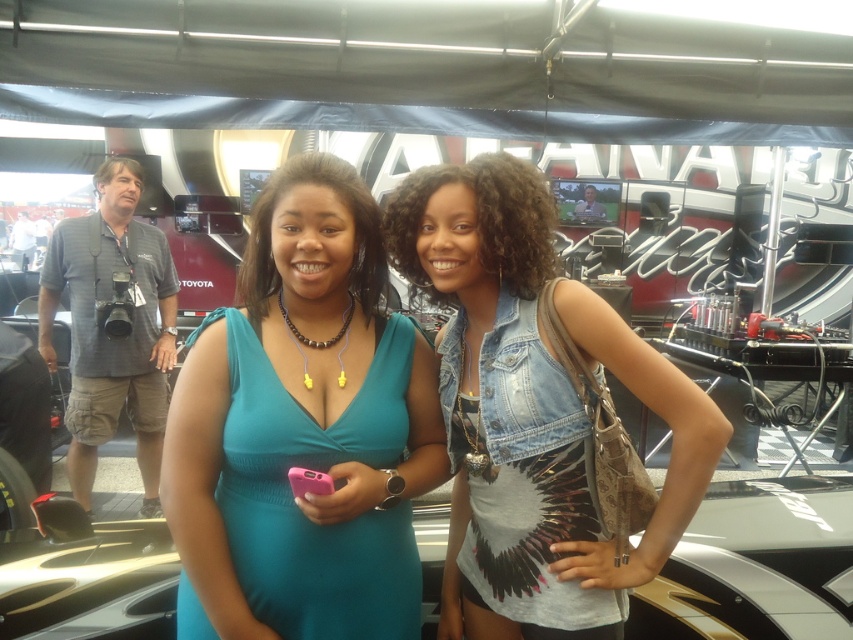
Question: Which point appears farthest from the camera in this image?

Choices:
 (A) (585, 577)
 (B) (299, 628)

Answer: (A)

Question: Among these objects, which one is farthest from the camera?

Choices:
 (A) teal fabric dress at center
 (B) denim vest at center

Answer: (B)

Question: Can you confirm if teal fabric dress at center is positioned to the right of denim vest at center?

Choices:
 (A) no
 (B) yes

Answer: (A)

Question: Is teal fabric dress at center in front of denim vest at center?

Choices:
 (A) yes
 (B) no

Answer: (A)

Question: Does teal fabric dress at center have a lesser width compared to denim vest at center?

Choices:
 (A) no
 (B) yes

Answer: (B)

Question: Among these points, which one is farthest from the camera?

Choices:
 (A) (415, 374)
 (B) (479, 541)

Answer: (B)